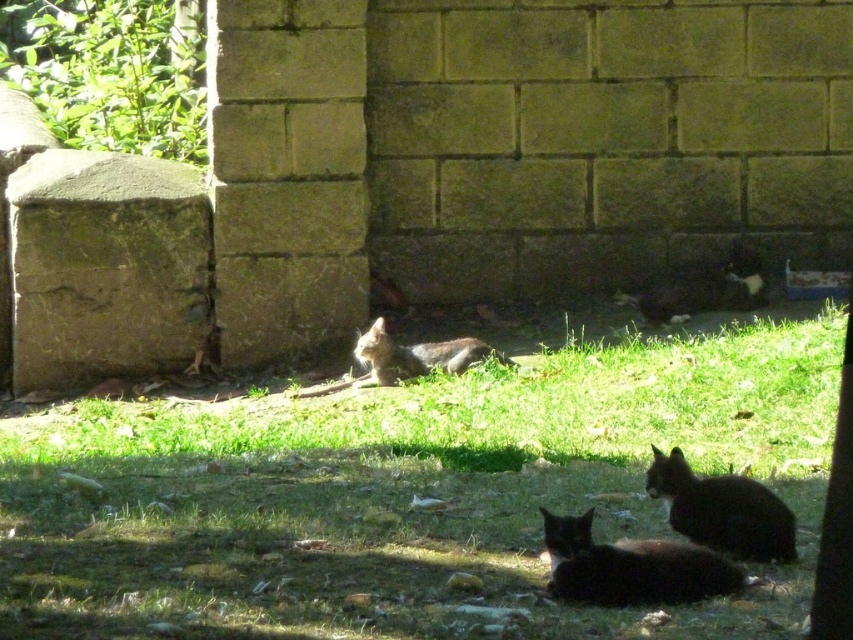
Question: Is black fur cat at lower right bigger than black fur cat at right?

Choices:
 (A) no
 (B) yes

Answer: (A)

Question: Can you confirm if green grass at center is wider than black fur cat at right?

Choices:
 (A) yes
 (B) no

Answer: (A)

Question: Which is farther from the green grass at center?

Choices:
 (A) black fur cat at lower center
 (B) black fur cat at right
 (C) fuzzy gray cat at center
 (D) black fur cat at lower right

Answer: (A)

Question: Which point is farther to the camera?

Choices:
 (A) (329, 611)
 (B) (733, 268)

Answer: (B)

Question: Is green grass at center thinner than black fur cat at right?

Choices:
 (A) no
 (B) yes

Answer: (A)

Question: Which point is closer to the camera?

Choices:
 (A) (347, 404)
 (B) (697, 276)
 (C) (379, 369)
 (D) (577, 554)

Answer: (D)